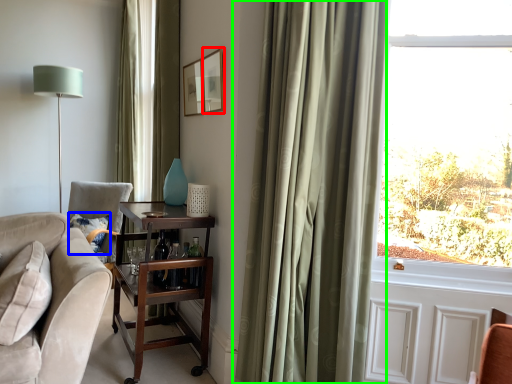
Question: Which is nearer to the picture frame (highlighted by a red box)? pillow (highlighted by a blue box) or curtain (highlighted by a green box).

Choices:
 (A) pillow
 (B) curtain

Answer: (B)